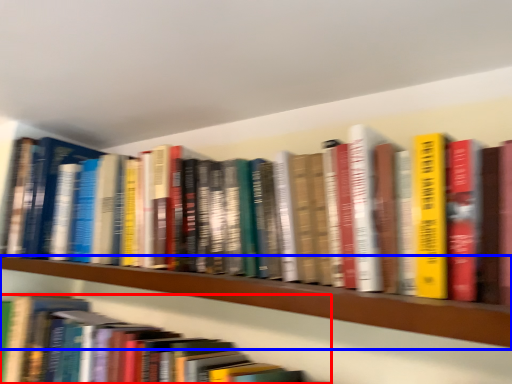
Question: Which object appears closest to the camera in this image, book (highlighted by a red box) or shelf (highlighted by a blue box)?

Choices:
 (A) book
 (B) shelf

Answer: (B)